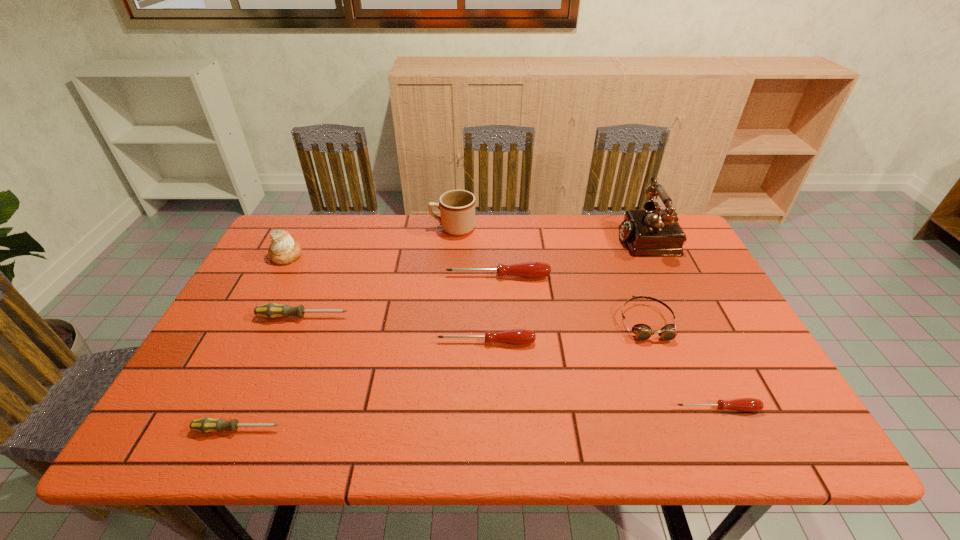
This screenshot has height=540, width=960. I want to click on vacant space at the near edge, so click(x=368, y=423).

The image size is (960, 540). Identify the location of vacant area at the left edge of the desktop. (237, 347).

This screenshot has width=960, height=540. I want to click on vacant space at the right edge of the desktop, so click(699, 335).

In the image, there is a desktop. Identify the location of vacant space at the far left corner. The height and width of the screenshot is (540, 960). [266, 247].

In the image, there is a desktop. At what (x,y) coordinates should I click in order to perform the action: click on vacant space at the near left corner. Please return your answer as a coordinate pair (x, y). Looking at the image, I should click on (186, 431).

Where is `vacant position at the near right corner of the desktop`? This screenshot has width=960, height=540. vacant position at the near right corner of the desktop is located at coordinates (721, 414).

Where is `vacant point located between the third nearest screwdriver and the shortest object`? The image size is (960, 540). vacant point located between the third nearest screwdriver and the shortest object is located at coordinates (602, 375).

Image resolution: width=960 pixels, height=540 pixels. Find the location of `unoccupied area between the brown telephone and the mug`. unoccupied area between the brown telephone and the mug is located at coordinates (552, 233).

Where is `vacant area between the pastry and the goggles`? Image resolution: width=960 pixels, height=540 pixels. vacant area between the pastry and the goggles is located at coordinates (467, 288).

This screenshot has height=540, width=960. What are the coordinates of `blank region between the second farthest red screwdriver and the third tallest object` in the screenshot? It's located at (386, 299).